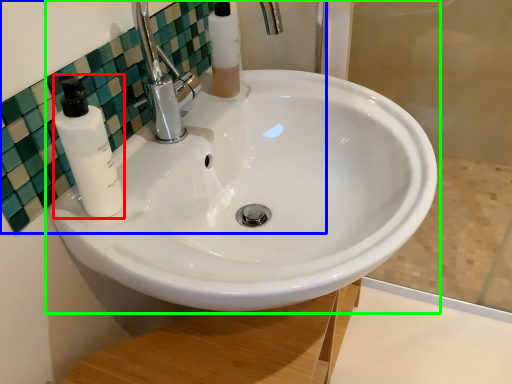
Question: Estimate the real-world distances between objects in this image. Which object is farther from soap dispenser (highlighted by a red box), mirror (highlighted by a blue box) or sink (highlighted by a green box)?

Choices:
 (A) mirror
 (B) sink

Answer: (B)